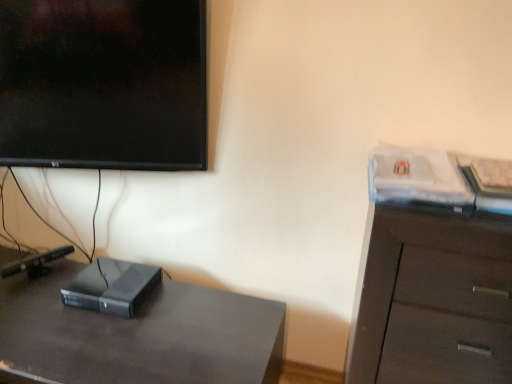
Find the location of `spots to the right of black matte computer at lower left`. spots to the right of black matte computer at lower left is located at coordinates (177, 308).